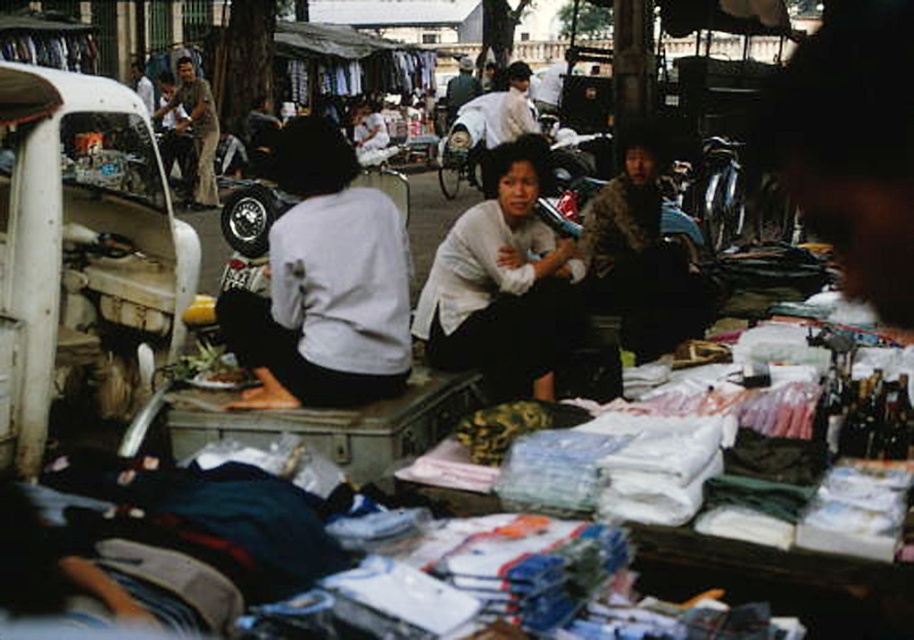
You are a customer at the market looking to buy a sweater and a jacket. You notice the white matte sweater at center and the camouflage jacket at center. Which item is taller when placed side by side?

The white matte sweater at center is taller than the camouflage jacket at center.

From the picture: You are standing in the market and want to pick up two items located at point [635,208] and point [190,61]. Which item should you reach for first to minimize the distance walked?

You should reach for the item at point [635,208] first because it is closer to you than point [190,61], so you can pick it up without moving further away.

You are a customer at the market and want to buy a camouflage jacket. The stall has items arranged in a grid. The camouflage jacket is located at point (639, 257). If you are standing at the origin point 0,0 at the bottom left corner of the stall, which direction should you move to reach the camouflage jacket?

The camouflage jacket at center is located at point (639, 257). Since you are at the origin 0,0 at the bottom left corner, you should move towards the right and upwards to reach the camouflage jacket.